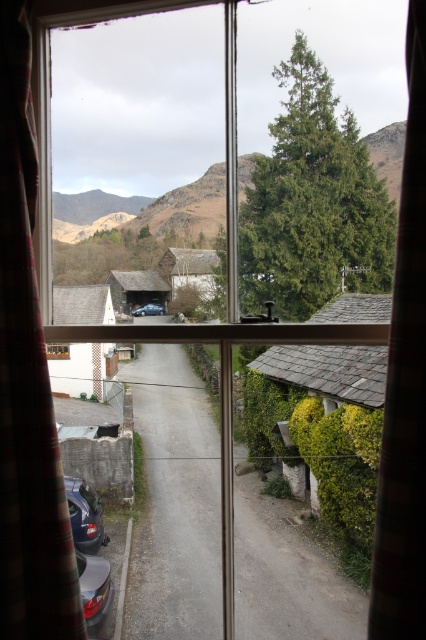
Between plaid fabric curtain at left and green textured tree at upper right, which one has more height?

green textured tree at upper right is taller.

Is point (5, 576) closer to camera compared to point (400, 132)?

Yes, point (5, 576) is in front of point (400, 132).

Is point (34, 424) behind point (86, 275)?

No, (34, 424) is closer to viewer.

Locate an element on the screen. The height and width of the screenshot is (640, 426). plaid fabric curtain at left is located at coordinates (26, 381).

Does green textured tree at upper right appear under metallic blue car at center?

Incorrect, green textured tree at upper right is not positioned below metallic blue car at center.

Can you confirm if green textured tree at upper right is positioned above metallic blue car at center?

Yes.

Is point (198, 193) behind point (157, 305)?

That is False.

The width and height of the screenshot is (426, 640). In order to click on green textured tree at upper right in this screenshot , I will do `click(135, 227)`.

Which is above, plaid fabric curtain at left or metallic silver car at lower left?

Positioned higher is plaid fabric curtain at left.

This screenshot has width=426, height=640. Describe the element at coordinates (26, 381) in the screenshot. I see `plaid fabric curtain at left` at that location.

Who is more distant from viewer, (14,324) or (86,582)?

Point (86,582)

This screenshot has width=426, height=640. In order to click on plaid fabric curtain at left in this screenshot , I will do `click(26, 381)`.